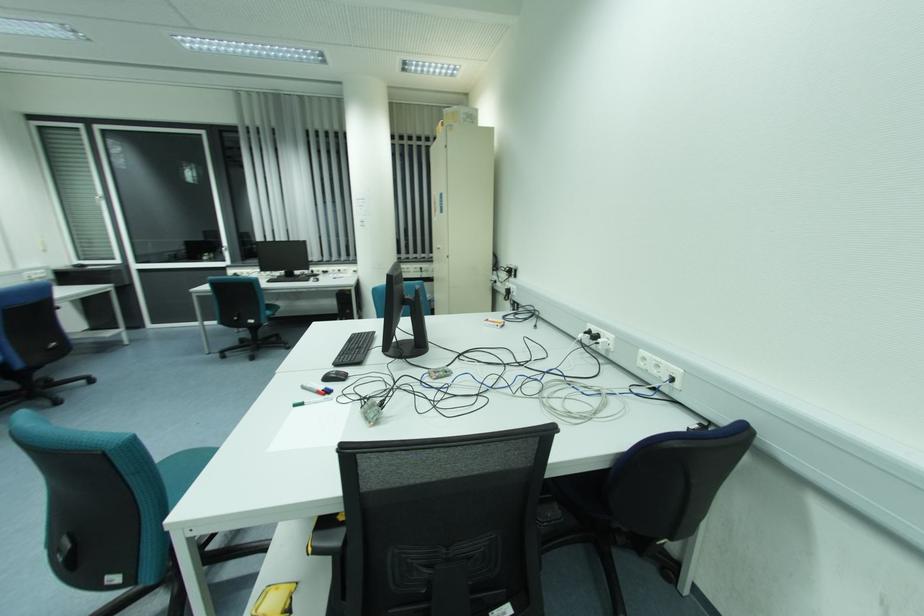
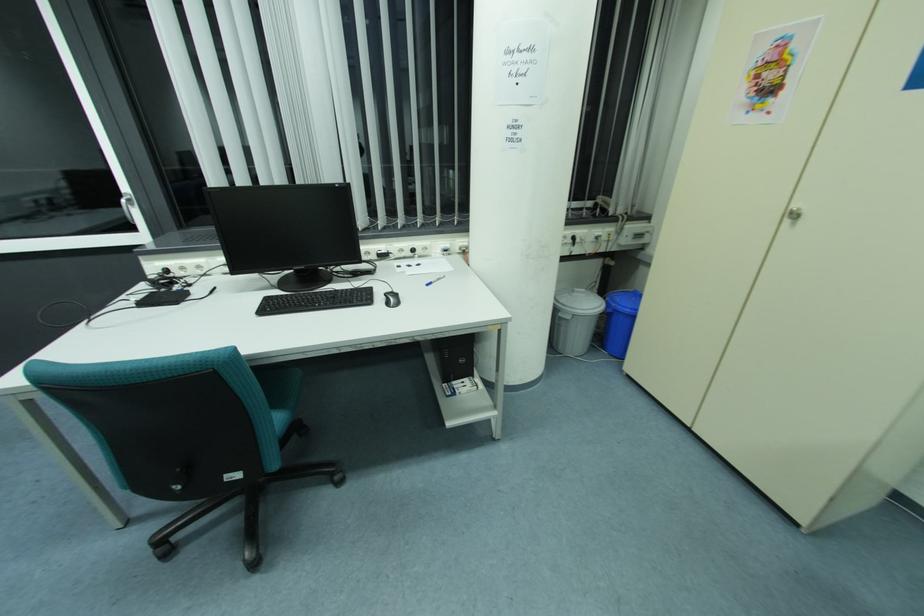
Locate, in the second image, the point that corresponds to the point at 348,312 in the first image.

(462, 361)